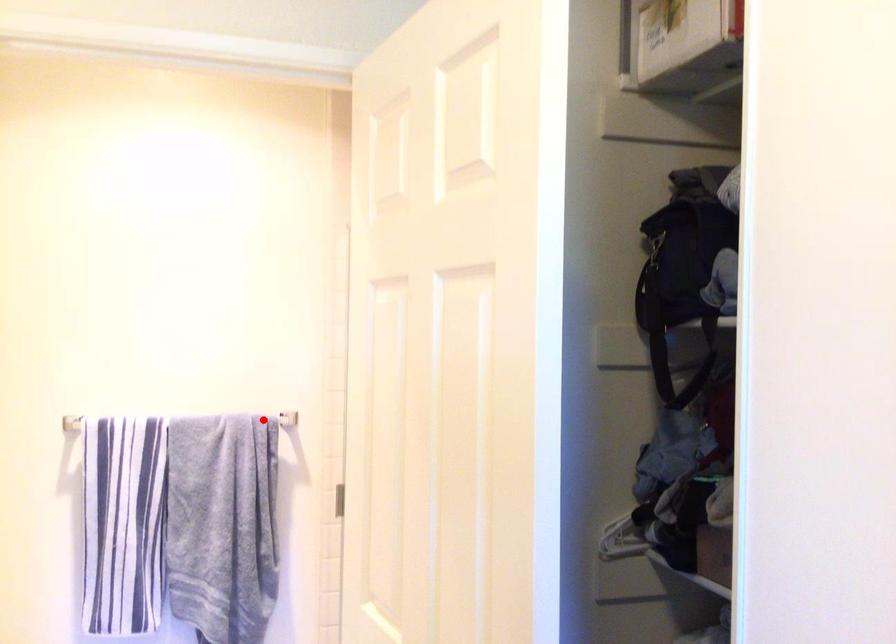
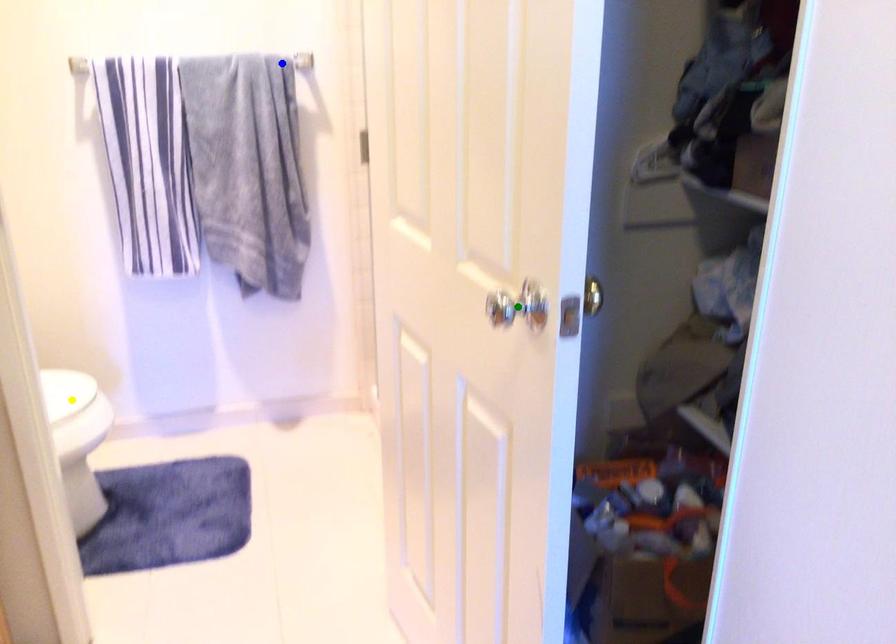
Question: I am providing you with two images of the same scene from different viewpoints. A red point is marked on the first image. You are given multiple points on the second image. In image 2, which mark is for the same physical point as the one in image 1?

Choices:
 (A) green point
 (B) blue point
 (C) yellow point

Answer: (B)